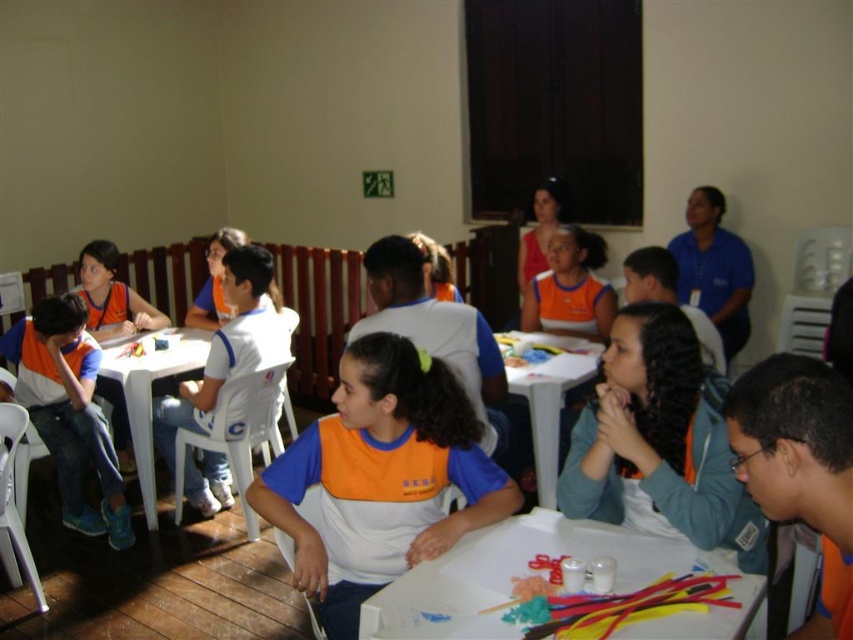
Question: Can you confirm if white matte shirt at center is smaller than orange fabric vest at center?

Choices:
 (A) no
 (B) yes

Answer: (A)

Question: Estimate the real-world distances between objects in this image. Which object is closer to the white matte shirt at center?

Choices:
 (A) orange fabric shirt at center
 (B) matte orange shirt at left
 (C) white plastic table at lower center

Answer: (B)

Question: Which object appears farthest from the camera in this image?

Choices:
 (A) white plastic table at lower left
 (B) orange fabric vest at center
 (C) white matte shirt at center

Answer: (B)

Question: Is white matte shirt at center thinner than white plastic table at lower left?

Choices:
 (A) yes
 (B) no

Answer: (B)

Question: Which point is farther to the camera?

Choices:
 (A) white matte shirt at center
 (B) orange fabric vest at center
 (C) matte orange shirt at left
 (D) white plastic table at center

Answer: (B)

Question: Considering the relative positions of orange fabric shirt at center and white plastic table at center in the image provided, where is orange fabric shirt at center located with respect to white plastic table at center?

Choices:
 (A) left
 (B) right

Answer: (A)